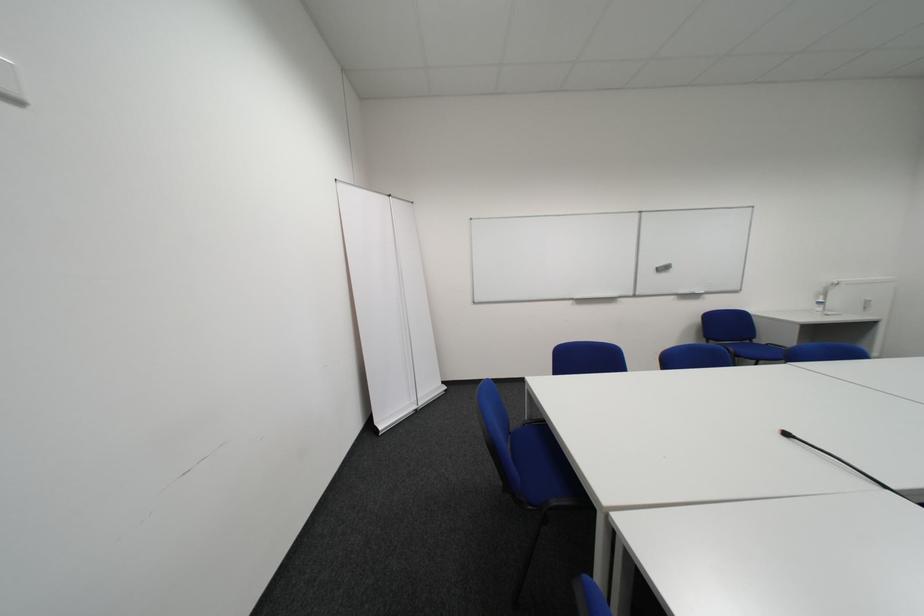
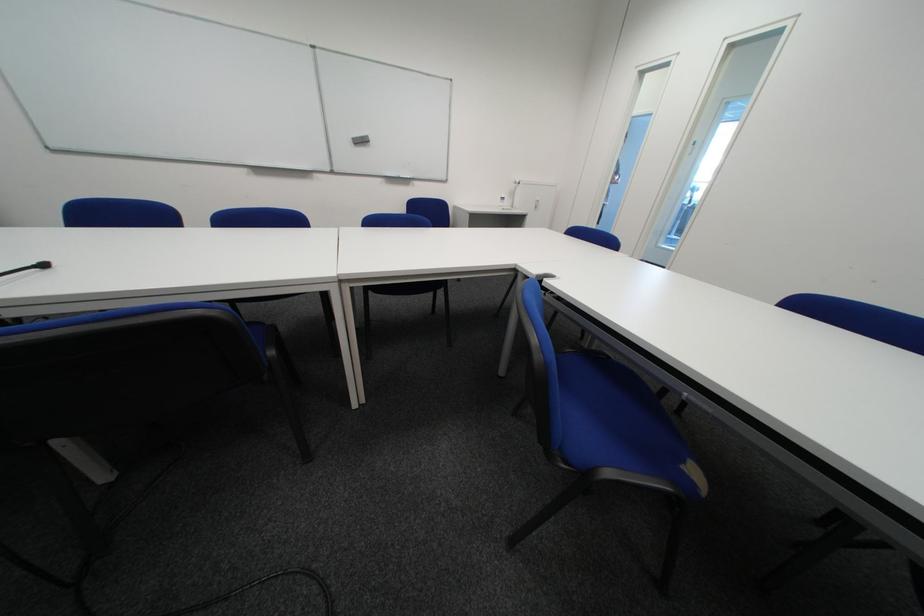
Question: I am providing you with two images of the same scene from different viewpoints. Please identify which objects are invisible in image2.

Choices:
 (A) green lotion bottle
 (B) blue chair sitting surface
 (C) black microphone
 (D) gray whiteboard eraser

Answer: (B)